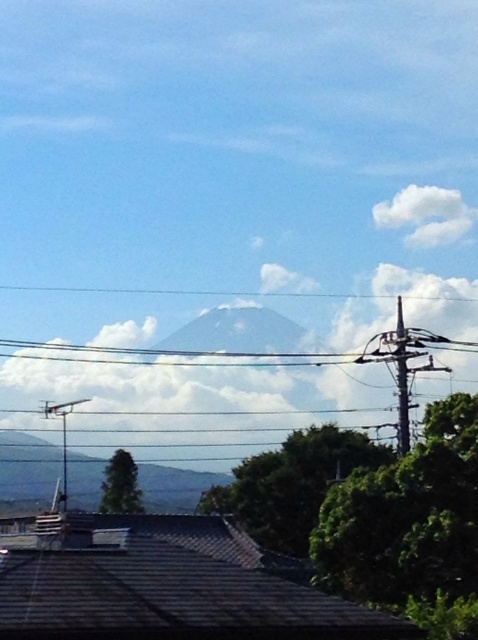
Is green leafy tree at center bigger than green leafy tree at lower left?

Actually, green leafy tree at center might be smaller than green leafy tree at lower left.

Does point (295, 467) come closer to viewer compared to point (134, 509)?

Yes, point (295, 467) is in front of point (134, 509).

Find the location of a particular element. This screenshot has width=478, height=640. green leafy tree at center is located at coordinates (293, 484).

Is gray rocky mountain at center closer to the viewer compared to white fluffy cloud at upper right?

Yes.

Which is in front, point (19, 492) or point (422, 218)?

Positioned in front is point (19, 492).

Who is more forward, (154, 470) or (416, 228)?

Point (154, 470)

In order to click on gray rocky mountain at center in this screenshot , I will do `click(26, 472)`.

Which is below, green leafy tree at center or metallic gray pole at right?

green leafy tree at center is below.

Looking at this image, which is more to the right, green leafy tree at center or metallic gray pole at right?

metallic gray pole at right is more to the right.

What are the coordinates of `green leafy tree at center` in the screenshot? It's located at (293, 484).